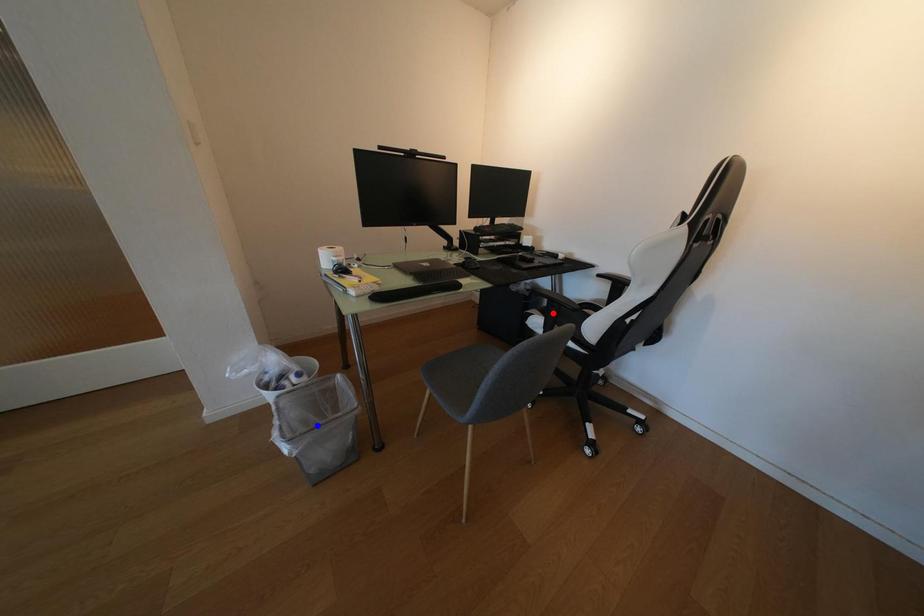
Question: Two points are marked on the image. Which point is closer to the camera?

Choices:
 (A) Blue point is closer.
 (B) Red point is closer.

Answer: (A)